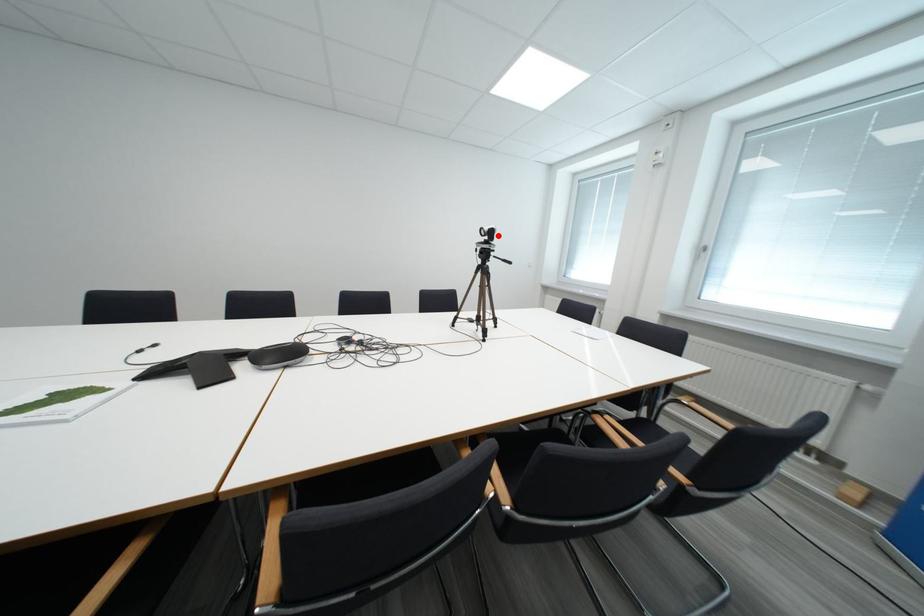
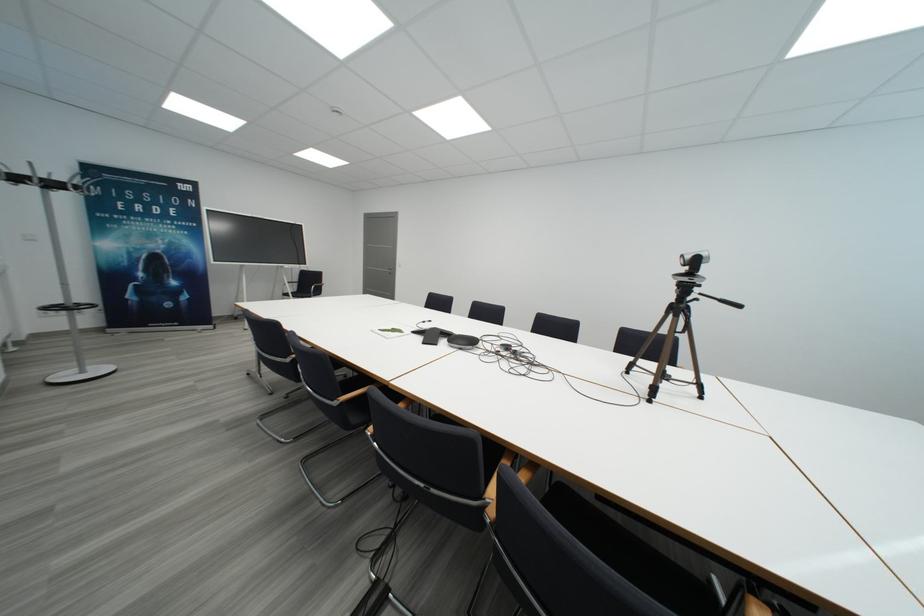
Where in the second image is the point corresponding to the highlighted location from the first image?

(702, 265)